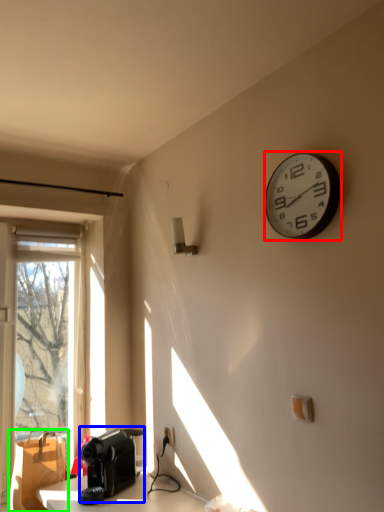
Question: Estimate the real-world distances between objects in this image. Which object is farther from wall clock (highlighted by a red box), appliance (highlighted by a blue box) or cardboard box (highlighted by a green box)?

Choices:
 (A) appliance
 (B) cardboard box

Answer: (B)